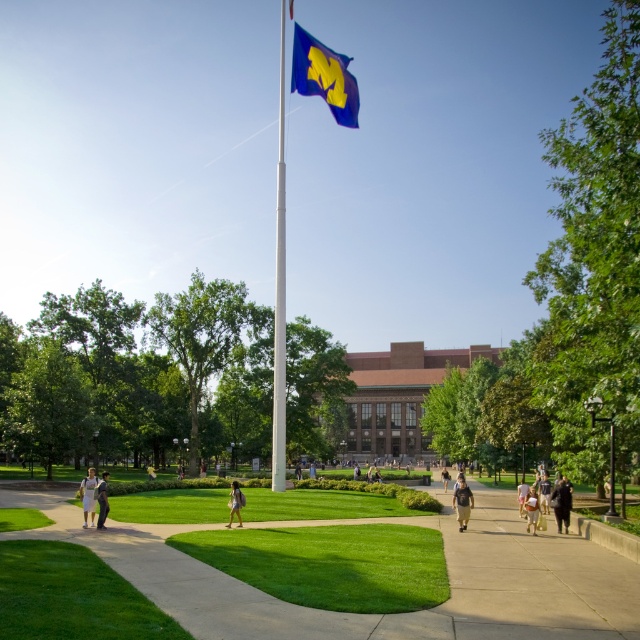
You are a photographer standing at the edge of the grassy area in the scene. You want to take a photo of both the light brown leather jacket at lower right and the light brown leather backpack at lower center. However, you notice that one of them is blocking the view of the flagpole. Which object is more likely blocking the flagpole?

The light brown leather jacket at lower right is much taller than the light brown leather backpack at lower center, so it is more likely blocking the view of the flagpole.

You are a photographer aiming to capture both the light brown leather jacket at lower right and the light brown leather backpack at lower center in a single frame. Given their sizes, which object should you focus on to ensure both fit clearly in the photo?

The light brown leather jacket at lower right is larger in size than the light brown leather backpack at lower center. To ensure both fit clearly in the photo, focus on the light brown leather jacket at lower right since it requires more space in the frame.